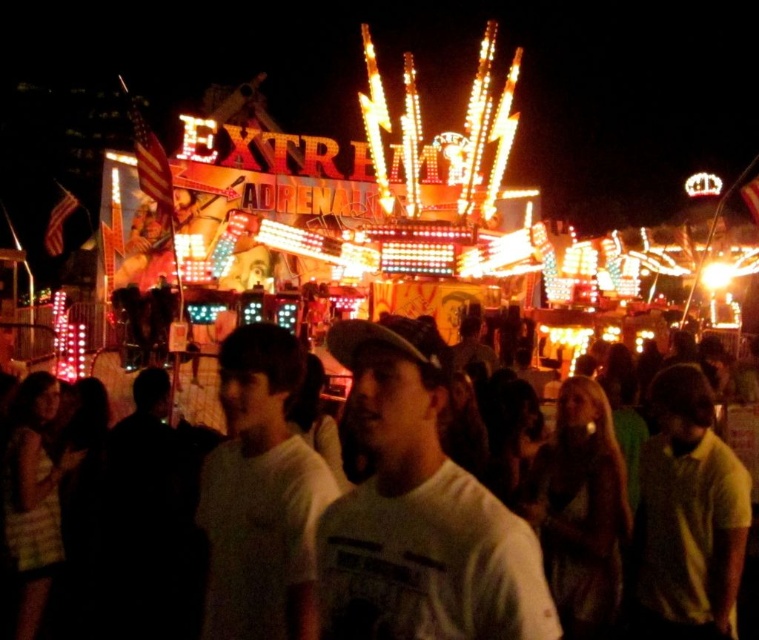
Does white matte shirt at center have a lesser height compared to white cotton shirt at center?

Yes.

Which is more to the right, white matte shirt at center or white cotton shirt at center?

Positioned to the right is white matte shirt at center.

I want to click on white matte shirt at center, so click(417, 516).